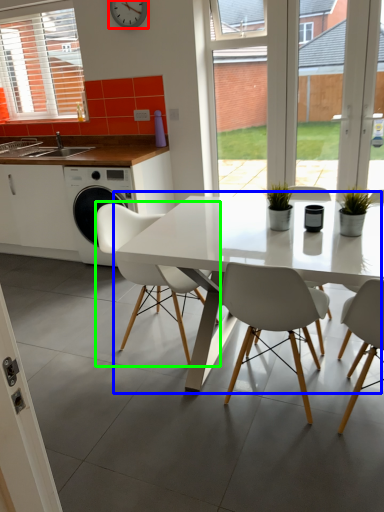
Question: Considering the real-world distances, which object is closest to clock (highlighted by a red box)? kitchen & dining room table (highlighted by a blue box) or chair (highlighted by a green box).

Choices:
 (A) kitchen & dining room table
 (B) chair

Answer: (B)